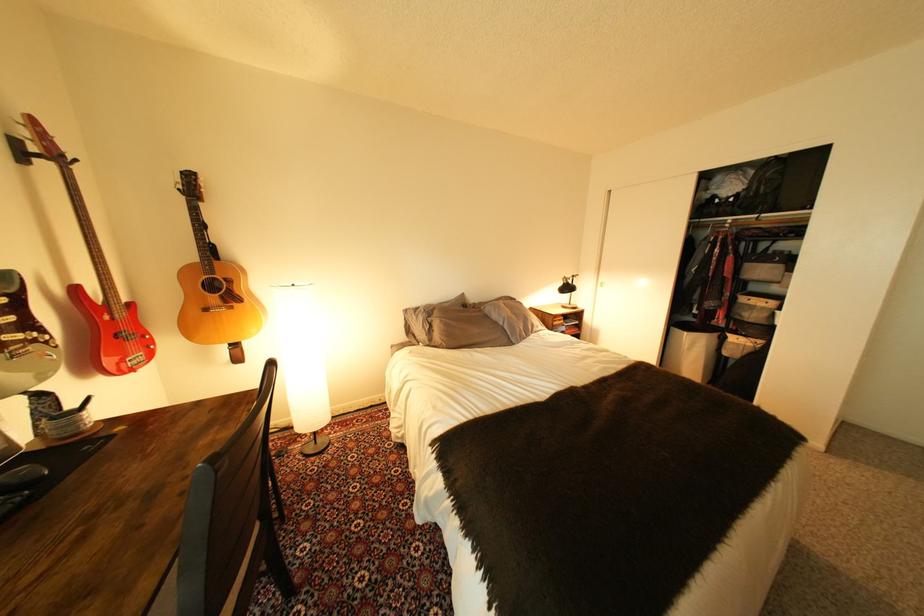
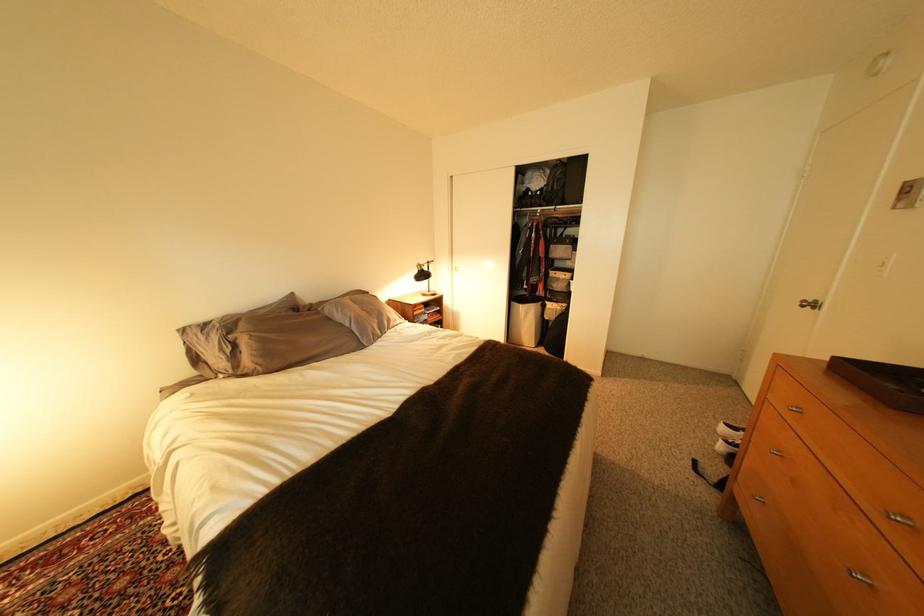
Which direction would the cameraman need to move to produce the second image?

The cameraman moved toward right, forward.